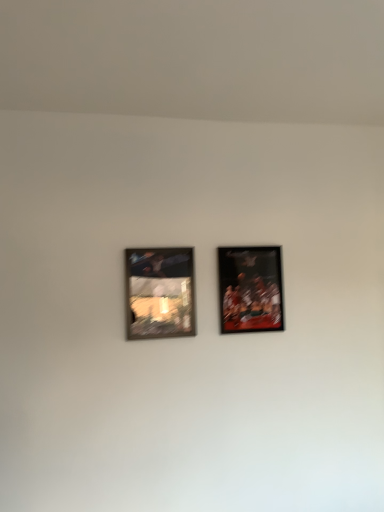
Question: Is point (142, 257) closer or farther from the camera than point (269, 251)?

Choices:
 (A) closer
 (B) farther

Answer: (A)

Question: From a real-world perspective, is wooden frame at left, the 1th picture frame from the left, above or below matte black picture frame at right, marked as the first picture frame in a right-to-left arrangement?

Choices:
 (A) above
 (B) below

Answer: (B)

Question: Visually, is wooden frame at left, the second picture frame in the right-to-left sequence, positioned to the left or to the right of matte black picture frame at right, the 2th picture frame positioned from the left?

Choices:
 (A) left
 (B) right

Answer: (A)

Question: Considering the positions of matte black picture frame at right, the 2th picture frame positioned from the left, and wooden frame at left, the 1th picture frame from the left, in the image, is matte black picture frame at right, the 2th picture frame positioned from the left, taller or shorter than wooden frame at left, the 1th picture frame from the left,?

Choices:
 (A) tall
 (B) short

Answer: (A)

Question: From the image's perspective, is matte black picture frame at right, marked as the first picture frame in a right-to-left arrangement, located above or below wooden frame at left, the second picture frame in the right-to-left sequence?

Choices:
 (A) below
 (B) above

Answer: (B)

Question: In the image, is matte black picture frame at right, marked as the first picture frame in a right-to-left arrangement, on the left side or the right side of wooden frame at left, the 1th picture frame from the left?

Choices:
 (A) right
 (B) left

Answer: (A)

Question: Is point (238, 297) positioned closer to the camera than point (162, 253)?

Choices:
 (A) farther
 (B) closer

Answer: (A)